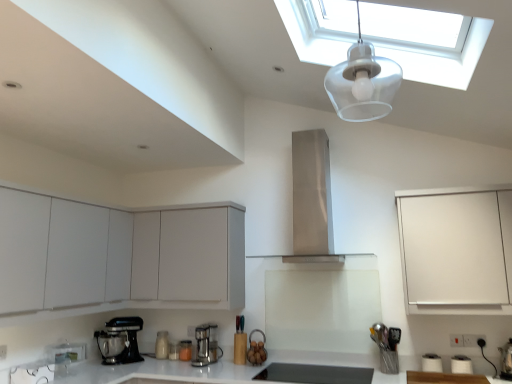
Question: Is satin chrome coffee maker at center, the first kitchen appliance viewed from the right, wider or thinner than transparent glass skylight at upper center?

Choices:
 (A) wide
 (B) thin

Answer: (B)

Question: From their relative heights in the image, would you say satin chrome coffee maker at center, the first kitchen appliance viewed from the right, is taller or shorter than transparent glass skylight at upper center?

Choices:
 (A) short
 (B) tall

Answer: (A)

Question: Estimate the real-world distances between objects in this image. Which object is closer to the satin chrome coffee maker at center, the first kitchen appliance viewed from the right?

Choices:
 (A) stainless steel range hood at center
 (B) metallic silver coffee maker at center, the second kitchen appliance positioned from the right
 (C) transparent glass skylight at upper center
 (D) white matte cabinet at lower left, which is the third cabinetry from right to left
 (E) white glossy countertop at lower center

Answer: (B)

Question: Based on their relative distances, which object is farther from the white glossy countertop at lower center?

Choices:
 (A) stainless steel range hood at center
 (B) transparent plastic light fixture at upper center
 (C) white matte cabinet at right, which is counted as the third cabinetry, starting from the left
 (D) white matte cabinet at lower left, which is counted as the 1th cabinetry, starting from the left
 (E) shiny black stove at lower center

Answer: (B)